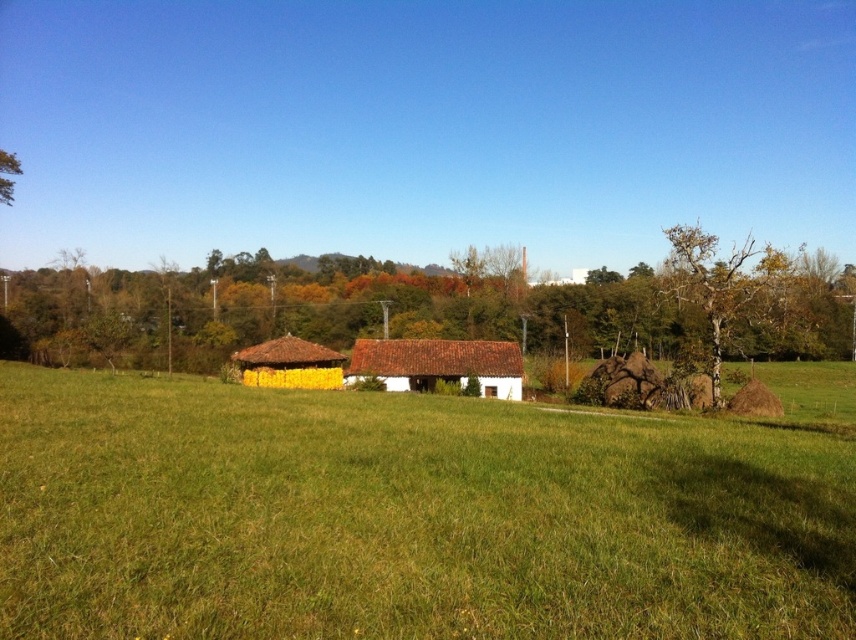
Is brown textured tree at right taller than white clay hut at center?

Yes, brown textured tree at right is taller than white clay hut at center.

Is brown textured tree at right below white clay hut at center?

Actually, brown textured tree at right is above white clay hut at center.

Locate an element on the screen. brown textured tree at right is located at coordinates (720, 284).

Who is more distant from viewer, (480, 385) or (265, 381)?

Point (480, 385)

What do you see at coordinates (438, 364) in the screenshot? I see `white clay hut at center` at bounding box center [438, 364].

This screenshot has width=856, height=640. I want to click on white clay hut at center, so click(x=438, y=364).

Can you confirm if white clay hut at center is positioned above green leafy tree at upper left?

No.

Describe the element at coordinates (438, 364) in the screenshot. The image size is (856, 640). I see `white clay hut at center` at that location.

At what (x,y) coordinates should I click in order to perform the action: click on white clay hut at center. Please return your answer as a coordinate pair (x, y). Looking at the image, I should click on (438, 364).